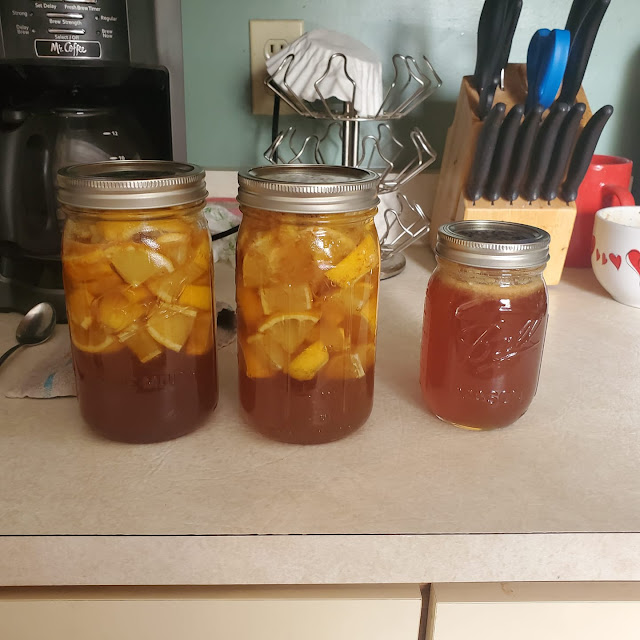
Locate an element on the screen. cabinet is located at coordinates (230, 630).